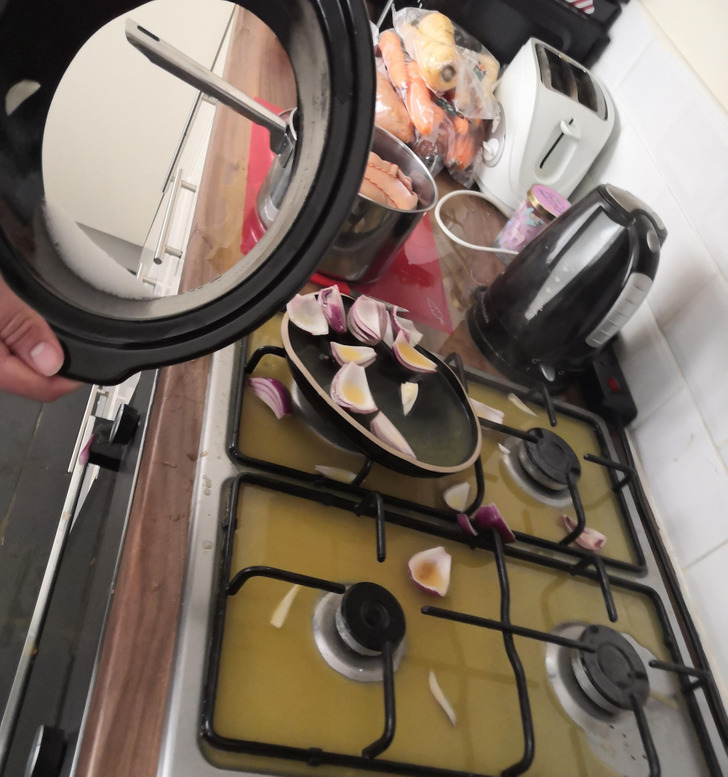
Where is `black electric kettle`? This screenshot has width=728, height=777. black electric kettle is located at coordinates (563, 312).